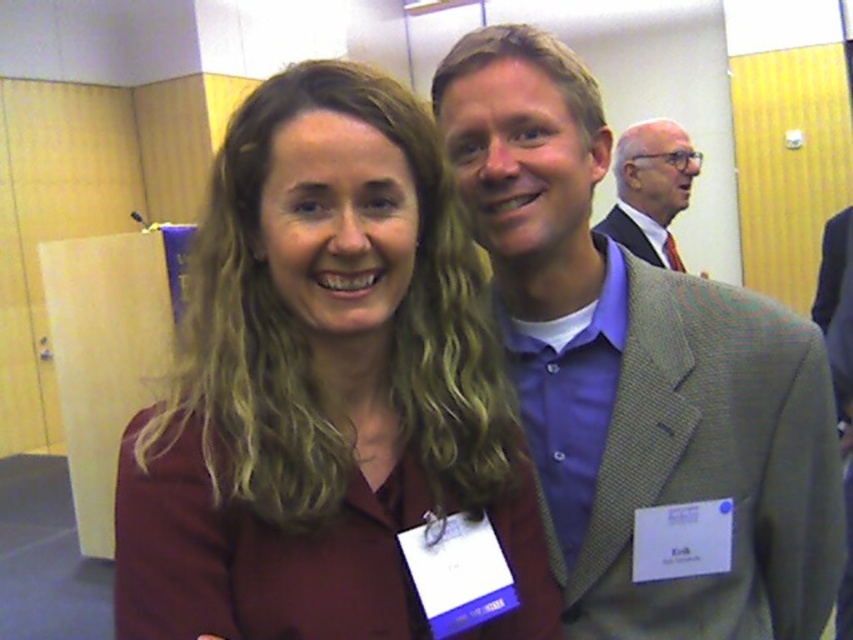
Is light brown textured blazer at center shorter than light brown textured suit at upper right?

Incorrect, light brown textured blazer at center's height does not fall short of light brown textured suit at upper right's.

The height and width of the screenshot is (640, 853). What do you see at coordinates (637, 371) in the screenshot? I see `light brown textured blazer at center` at bounding box center [637, 371].

The width and height of the screenshot is (853, 640). What are the coordinates of `light brown textured blazer at center` in the screenshot? It's located at (637, 371).

Does point (357, 376) come in front of point (664, 228)?

Yes, point (357, 376) is in front of point (664, 228).

Find the location of a particular element. The height and width of the screenshot is (640, 853). maroon fabric shirt at center is located at coordinates (323, 387).

Which is above, light brown textured blazer at center or light brown suit at upper right?

light brown suit at upper right

Measure the distance between light brown textured blazer at center and camera.

36.57 inches

At what (x,y) coordinates should I click in order to perform the action: click on light brown textured blazer at center. Please return your answer as a coordinate pair (x, y). Image resolution: width=853 pixels, height=640 pixels. Looking at the image, I should click on (637, 371).